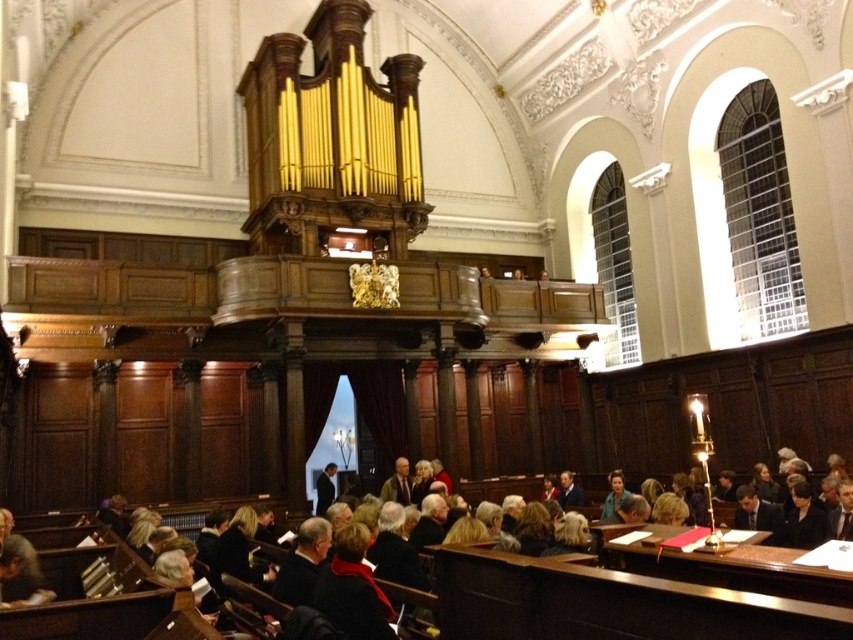
Question: Is dark brown leather jacket at lower center wider than dark suit at center?

Choices:
 (A) yes
 (B) no

Answer: (A)

Question: Which of these objects is positioned farthest from the dark suit at center?

Choices:
 (A) light brown leather jacket at center
 (B) green fabric jacket at center
 (C) dark brown leather jacket at center
 (D) dark brown leather jacket at lower center

Answer: (D)

Question: Which object is closer to the camera taking this photo?

Choices:
 (A) dark brown leather jacket at lower center
 (B) green fabric jacket at center

Answer: (A)

Question: Can you confirm if light brown leather jacket at center is smaller than dark suit at center?

Choices:
 (A) no
 (B) yes

Answer: (B)

Question: Estimate the real-world distances between objects in this image. Which object is farther from the dark suit at center?

Choices:
 (A) green fabric jacket at center
 (B) dark brown leather jacket at lower center
 (C) dark brown leather jacket at center
 (D) light brown leather jacket at center

Answer: (B)

Question: Does dark brown leather jacket at lower center have a larger size compared to dark suit at center?

Choices:
 (A) no
 (B) yes

Answer: (B)